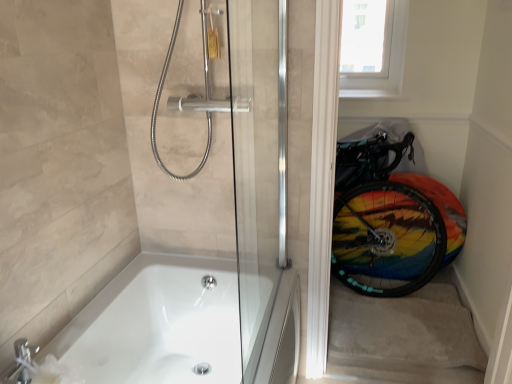
The width and height of the screenshot is (512, 384). What do you see at coordinates (404, 337) in the screenshot?
I see `carpeted stairwell at lower right` at bounding box center [404, 337].

What do you see at coordinates (157, 325) in the screenshot?
I see `white glossy bathtub at lower left` at bounding box center [157, 325].

At what (x,y) coordinates should I click in order to perform the action: click on carpeted stairwell at lower right. Please return your answer as a coordinate pair (x, y). This screenshot has height=384, width=512. Looking at the image, I should click on (404, 337).

From the image's perspective, is transparent glass door at right above or below white plastic window screen at upper right?

From the image's perspective, transparent glass door at right appears below white plastic window screen at upper right.

How different are the orientations of transparent glass door at right and white plastic window screen at upper right in degrees?

The angle between the facing direction of transparent glass door at right and the facing direction of white plastic window screen at upper right is 0.584 degrees.

Find the location of a particular element. This screenshot has height=384, width=512. window screen on the right of the transparent glass door at right is located at coordinates (382, 59).

Is transparent glass door at right in front of or behind white plastic window screen at upper right in the image?

In the image, transparent glass door at right appears in front of white plastic window screen at upper right.

Looking at this image, who is shorter, white plastic window screen at upper right or carpeted stairwell at lower right?

With less height is carpeted stairwell at lower right.

Would you say white plastic window screen at upper right is a long distance from carpeted stairwell at lower right?

Indeed, white plastic window screen at upper right is not near carpeted stairwell at lower right.

Looking at their sizes, would you say white plastic window screen at upper right is wider or thinner than carpeted stairwell at lower right?

Clearly, white plastic window screen at upper right has less width compared to carpeted stairwell at lower right.

Which of these two, transparent glass door at right or white glossy bathtub at lower left, is smaller?

transparent glass door at right is smaller.

From the image's perspective, is transparent glass door at right beneath white glossy bathtub at lower left?

No, from the image's perspective, transparent glass door at right is not beneath white glossy bathtub at lower left.

Based on the photo, does transparent glass door at right lie in front of white glossy bathtub at lower left?

No, transparent glass door at right is behind white glossy bathtub at lower left.

Measure the distance between transparent glass door at right and white glossy bathtub at lower left.

4.58 feet.

Could white plastic window screen at upper right be considered to be inside rainbow painted tire at lower right?

That's incorrect, white plastic window screen at upper right is not inside rainbow painted tire at lower right.

Which object is positioned more to the left, rainbow painted tire at lower right or white plastic window screen at upper right?

Positioned to the left is white plastic window screen at upper right.

Which point is more forward, (367, 209) or (390, 61)?

The point (367, 209) is closer.

Is rainbow painted tire at lower right looking in the opposite direction of white plastic window screen at upper right?

That's not correct — rainbow painted tire at lower right is not looking away from white plastic window screen at upper right.

Is carpeted stairwell at lower right situated inside white glossy bathtub at lower left or outside?

carpeted stairwell at lower right is not enclosed by white glossy bathtub at lower left.

From a real-world perspective, is carpeted stairwell at lower right positioned over white glossy bathtub at lower left based on gravity?

No, from a real-world perspective, carpeted stairwell at lower right is not on top of white glossy bathtub at lower left.

Can you confirm if carpeted stairwell at lower right is positioned to the right of white glossy bathtub at lower left?

Correct, you'll find carpeted stairwell at lower right to the right of white glossy bathtub at lower left.

Considering the relative sizes of carpeted stairwell at lower right and white glossy bathtub at lower left in the image provided, is carpeted stairwell at lower right smaller than white glossy bathtub at lower left?

Correct, carpeted stairwell at lower right occupies less space than white glossy bathtub at lower left.

Is white plastic window screen at upper right next to transparent glass door at right?

No, white plastic window screen at upper right is not next to transparent glass door at right.

You are a GUI agent. You are given a task and a screenshot of the screen. Output one action in this format:
    pyautogui.click(x=<x>, y=<y>)
    Task: Click on the glass door below the white plastic window screen at upper right (from the image's perspective)
    
    Given the screenshot: What is the action you would take?
    pyautogui.click(x=462, y=132)

Can we say white plastic window screen at upper right lies outside transparent glass door at right?

Yes, white plastic window screen at upper right is located beyond the bounds of transparent glass door at right.

Does white plastic window screen at upper right appear on the left side of transparent glass door at right?

Incorrect, white plastic window screen at upper right is not on the left side of transparent glass door at right.

How many degrees apart are the facing directions of transparent glass door at right and carpeted stairwell at lower right?

The angular difference between transparent glass door at right and carpeted stairwell at lower right is 0.056 degrees.

Is transparent glass door at right far from carpeted stairwell at lower right?

They are positioned close to each other.

Does transparent glass door at right have a lesser width compared to carpeted stairwell at lower right?

Indeed, transparent glass door at right has a lesser width compared to carpeted stairwell at lower right.

Measure the distance between transparent glass door at right and carpeted stairwell at lower right.

transparent glass door at right and carpeted stairwell at lower right are 23.40 inches apart from each other.

This screenshot has height=384, width=512. What are the coordinates of `window screen behind the transparent glass door at right` in the screenshot? It's located at (382, 59).

Image resolution: width=512 pixels, height=384 pixels. I want to click on window screen lying on the left of carpeted stairwell at lower right, so click(x=382, y=59).

Estimate the real-world distances between objects in this image. Which object is closer to white plastic window screen at upper right, white glossy bathtub at lower left or carpeted stairwell at lower right?

Among the two, carpeted stairwell at lower right is located nearer to white plastic window screen at upper right.

Which object lies further to the anchor point white plastic window screen at upper right, rainbow painted tire at lower right or transparent glass door at right?

rainbow painted tire at lower right is positioned further to the anchor white plastic window screen at upper right.

From the image, which object appears to be nearer to white glossy bathtub at lower left, white plastic window screen at upper right or carpeted stairwell at lower right?

Based on the image, carpeted stairwell at lower right appears to be nearer to white glossy bathtub at lower left.

When comparing their distances from white glossy bathtub at lower left, does transparent glass door at right or rainbow painted tire at lower right seem further?

Among the two, transparent glass door at right is located further to white glossy bathtub at lower left.

Based on their spatial positions, is white glossy bathtub at lower left or rainbow painted tire at lower right further from transparent glass door at right?

white glossy bathtub at lower left lies further to transparent glass door at right than the other object.

When comparing their distances from rainbow painted tire at lower right, does transparent glass door at right or white plastic window screen at upper right seem closer?

Among the two, transparent glass door at right is located nearer to rainbow painted tire at lower right.

From the image, which object appears to be farther from carpeted stairwell at lower right, white glossy bathtub at lower left or white plastic window screen at upper right?

The object further to carpeted stairwell at lower right is white plastic window screen at upper right.

Considering their positions, is rainbow painted tire at lower right positioned closer to transparent glass door at right than white plastic window screen at upper right?

Based on the image, rainbow painted tire at lower right appears to be nearer to transparent glass door at right.

Identify the location of glass door between white glossy bathtub at lower left and white plastic window screen at upper right along the z-axis. This screenshot has height=384, width=512. (462, 132).

Where is `bicycle wheel between white plastic window screen at upper right and white glossy bathtub at lower left from top to bottom`? bicycle wheel between white plastic window screen at upper right and white glossy bathtub at lower left from top to bottom is located at coordinates (386, 239).

What are the coordinates of `bicycle wheel between transparent glass door at right and white plastic window screen at upper right along the z-axis` in the screenshot? It's located at (386, 239).

Identify the location of glass door between white glossy bathtub at lower left and rainbow painted tire at lower right from front to back. This screenshot has width=512, height=384. (462, 132).